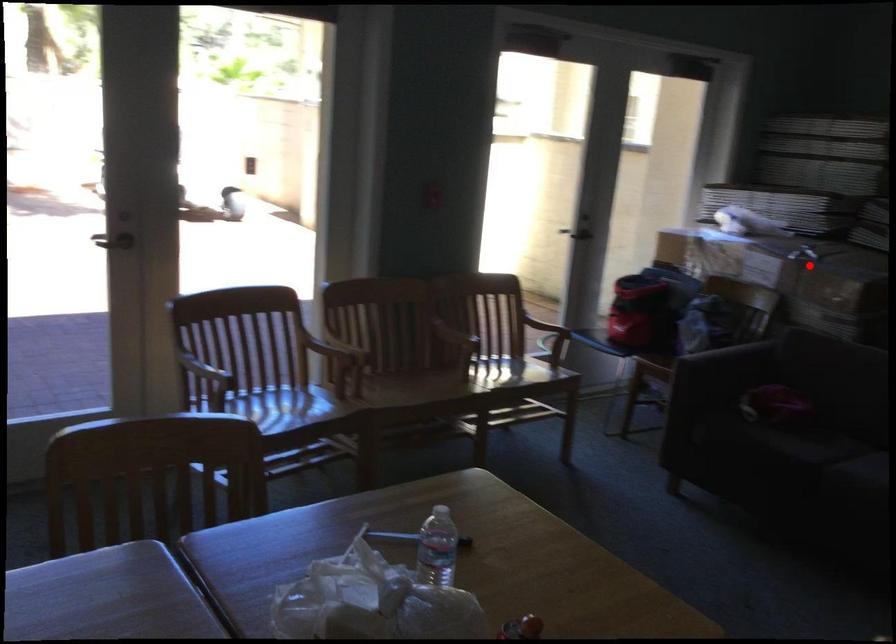
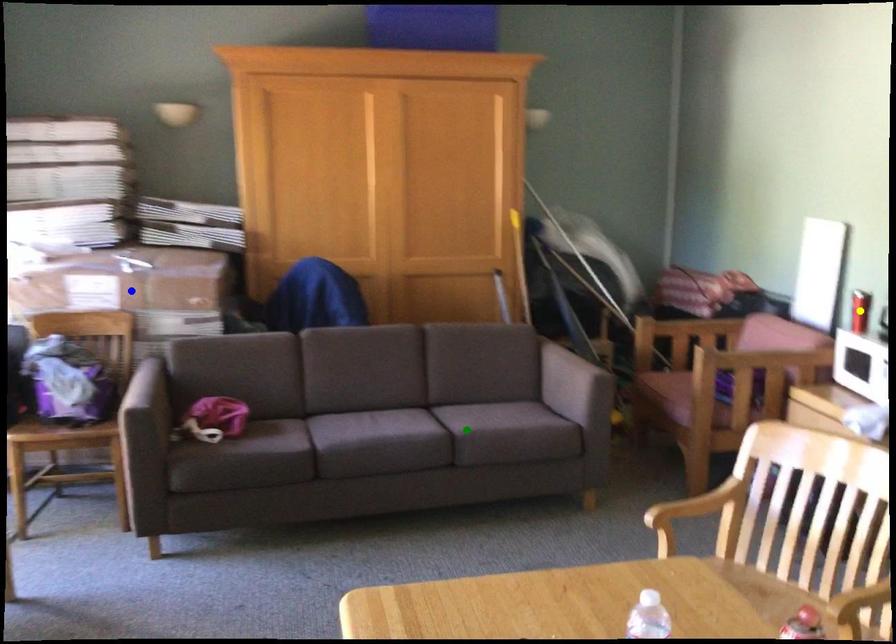
Question: I am providing you with two images of the same scene from different viewpoints. A red point is marked on the first image. You are given multiple points on the second image. Which mark in image 2 goes with the point in image 1?

Choices:
 (A) green point
 (B) yellow point
 (C) blue point

Answer: (C)